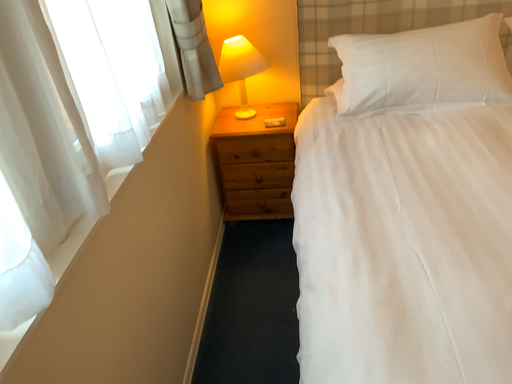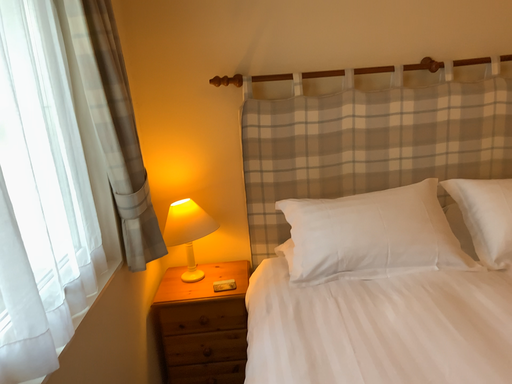
Question: Which way did the camera rotate in the video?

Choices:
 (A) rotated upward
 (B) rotated downward

Answer: (A)